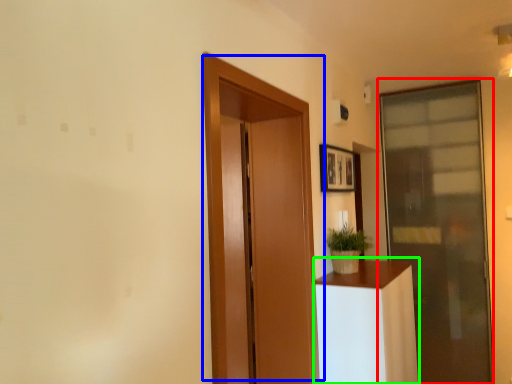
Question: Considering the real-world distances, which object is closest to door (highlighted by a red box)? door (highlighted by a blue box) or furniture (highlighted by a green box).

Choices:
 (A) door
 (B) furniture

Answer: (B)